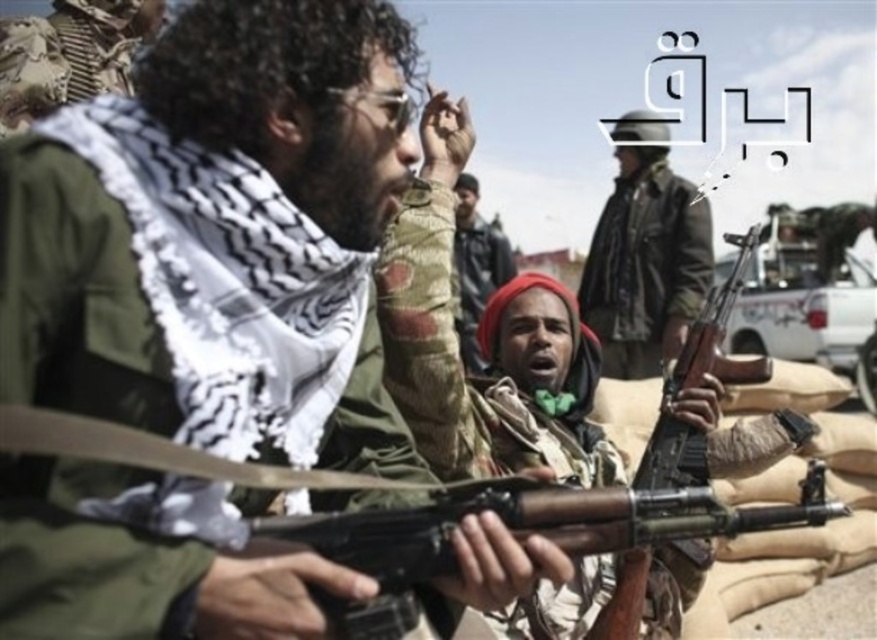
Question: Can you confirm if matte black helmet at upper center is smaller than camouflage-patterned uniform at center?

Choices:
 (A) no
 (B) yes

Answer: (B)

Question: Which of the following is the farthest from the observer?

Choices:
 (A) (473, 364)
 (B) (619, 196)

Answer: (B)

Question: Does matte black helmet at upper center come behind camouflage-patterned uniform at center?

Choices:
 (A) yes
 (B) no

Answer: (A)

Question: Which of the following is the closest to the observer?

Choices:
 (A) camouflage-patterned uniform at center
 (B) matte black helmet at upper center

Answer: (A)

Question: Is matte black helmet at upper center thinner than camouflage-patterned uniform at center?

Choices:
 (A) yes
 (B) no

Answer: (B)